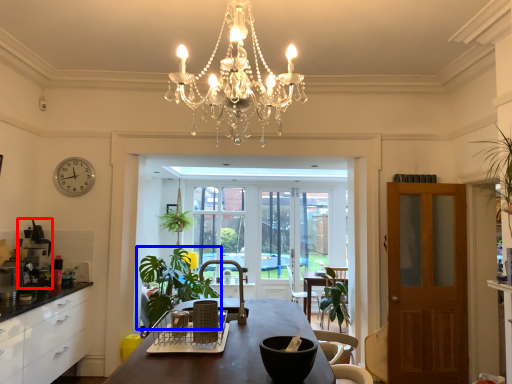
Question: Which object appears farthest to the camera in this image, coffee machine (highlighted by a red box) or houseplant (highlighted by a blue box)?

Choices:
 (A) coffee machine
 (B) houseplant

Answer: (B)